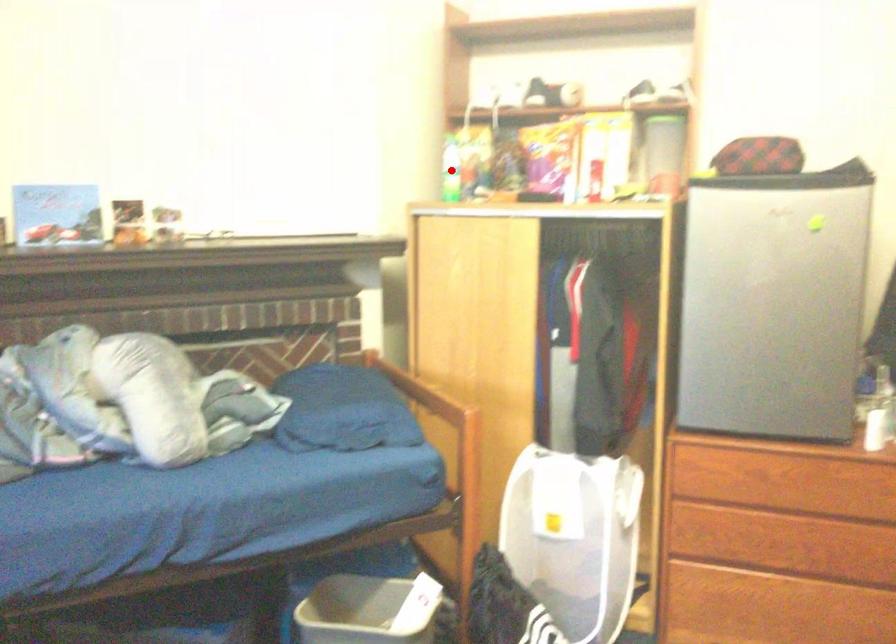
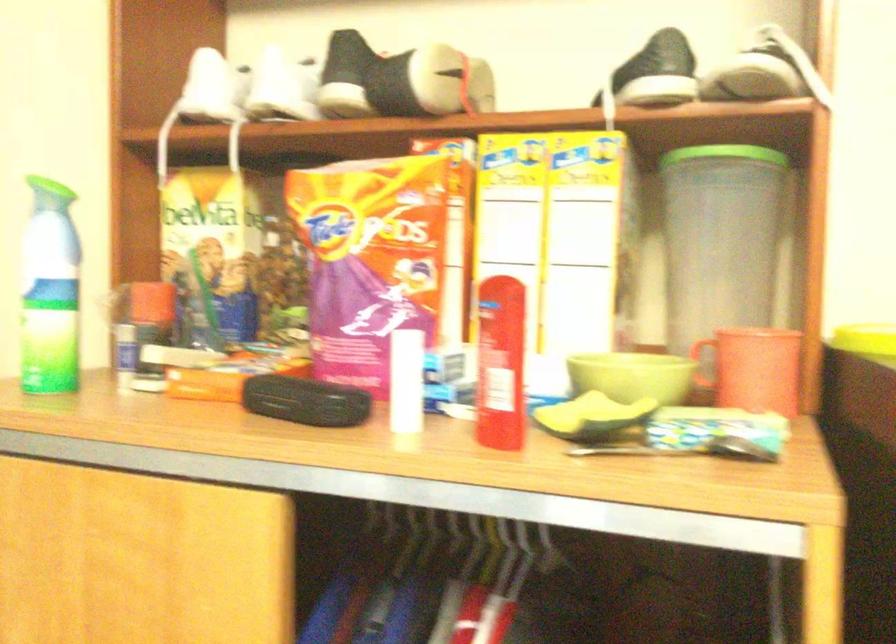
Question: I am providing you with two images of the same scene from different viewpoints. A red point is shown in image1. For the corresponding object point in image2, is it positioned nearer or farther from the camera?

Choices:
 (A) Nearer
 (B) Farther

Answer: (A)